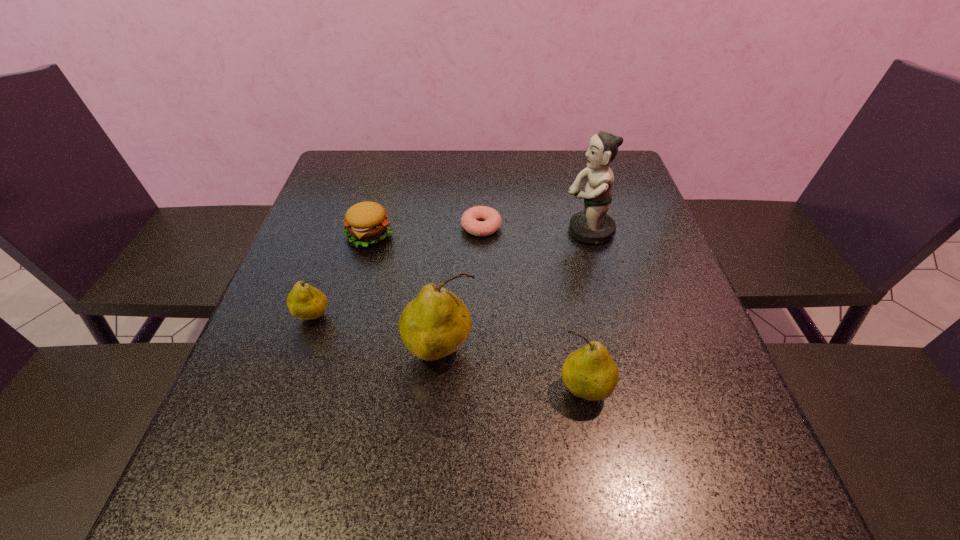
You are a GUI agent. You are given a task and a screenshot of the screen. Output one action in this format:
    pyautogui.click(x=<x>, y=<y>)
    Task: Click on the object that is at the right edge
    
    Given the screenshot: What is the action you would take?
    pyautogui.click(x=593, y=225)

I want to click on free point at the far edge, so click(526, 179).

In the image, there is a desktop. Where is `vacant space at the near edge`? This screenshot has height=540, width=960. vacant space at the near edge is located at coordinates (503, 395).

At what (x,y) coordinates should I click in order to perform the action: click on vacant space at the left edge of the desktop. Please return your answer as a coordinate pair (x, y). Image resolution: width=960 pixels, height=540 pixels. Looking at the image, I should click on (x=264, y=335).

In the image, there is a desktop. At what (x,y) coordinates should I click in order to perform the action: click on vacant space at the right edge. Please return your answer as a coordinate pair (x, y). This screenshot has height=540, width=960. Looking at the image, I should click on (687, 392).

Locate an element on the screen. vacant region at the far left corner of the desktop is located at coordinates (383, 150).

At what (x,y) coordinates should I click in order to perform the action: click on vacant space at the far right corner of the desktop. Please return your answer as a coordinate pair (x, y). This screenshot has width=960, height=540. Looking at the image, I should click on (635, 190).

The image size is (960, 540). In order to click on empty space between the figurine and the doughnut in this screenshot , I will do coord(535,229).

Image resolution: width=960 pixels, height=540 pixels. What are the coordinates of `free space between the tallest object and the leftmost pear` in the screenshot? It's located at (451, 274).

The width and height of the screenshot is (960, 540). I want to click on vacant region between the fourth shortest object and the fifth shortest object, so click(x=513, y=371).